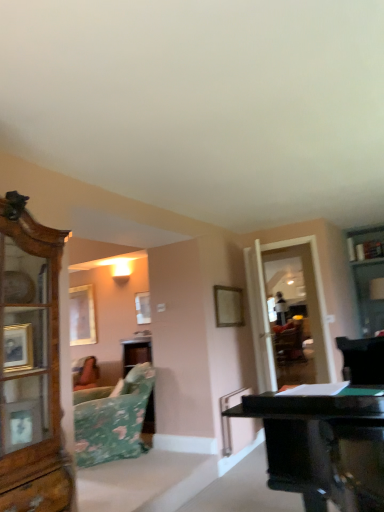
Question: From a real-world perspective, is wooden picture frame at upper left, the 2th picture frame positioned from the front, positioned over floral fabric couch at lower left based on gravity?

Choices:
 (A) yes
 (B) no

Answer: (A)

Question: Is wooden picture frame at upper left, arranged as the 2th picture frame when viewed from the right, at the left side of floral fabric couch at lower left?

Choices:
 (A) no
 (B) yes

Answer: (B)

Question: Is wooden picture frame at upper left, the 2th picture frame positioned from the front, positioned far away from floral fabric couch at lower left?

Choices:
 (A) no
 (B) yes

Answer: (B)

Question: Is wooden picture frame at upper left, arranged as the 2th picture frame when viewed from the right, outside of floral fabric couch at lower left?

Choices:
 (A) no
 (B) yes

Answer: (B)

Question: Is wooden picture frame at upper left, the 1th picture frame when ordered from back to front, to the right of floral fabric couch at lower left from the viewer's perspective?

Choices:
 (A) no
 (B) yes

Answer: (A)

Question: Is transparent glass door at right inside the boundaries of wooden picture frame at center, marked as the 2th picture frame in a back-to-front arrangement, or outside?

Choices:
 (A) inside
 (B) outside

Answer: (B)

Question: From the image's perspective, is transparent glass door at right located above or below wooden picture frame at center, placed as the 2th picture frame when sorted from left to right?

Choices:
 (A) above
 (B) below

Answer: (B)

Question: Based on their sizes in the image, would you say transparent glass door at right is bigger or smaller than wooden picture frame at center, placed as the 2th picture frame when sorted from left to right?

Choices:
 (A) big
 (B) small

Answer: (A)

Question: From a real-world perspective, is transparent glass door at right positioned above or below wooden picture frame at center, the first picture frame positioned from the front?

Choices:
 (A) above
 (B) below

Answer: (B)

Question: Would you say wooden picture frame at upper left, which is the first picture frame from left to right, is to the left or to the right of wooden picture frame at center, placed as the 2th picture frame when sorted from left to right, in the picture?

Choices:
 (A) right
 (B) left

Answer: (B)

Question: From their relative heights in the image, would you say wooden picture frame at upper left, arranged as the 2th picture frame when viewed from the right, is taller or shorter than wooden picture frame at center, placed as the 2th picture frame when sorted from left to right?

Choices:
 (A) tall
 (B) short

Answer: (A)

Question: In the image, is wooden picture frame at upper left, arranged as the 2th picture frame when viewed from the right, positioned in front of or behind wooden picture frame at center, marked as the 2th picture frame in a back-to-front arrangement?

Choices:
 (A) front
 (B) behind

Answer: (B)

Question: Does point (72, 309) appear closer or farther from the camera than point (241, 296)?

Choices:
 (A) closer
 (B) farther

Answer: (B)

Question: Would you say floral fabric couch at lower left is to the left or to the right of wooden picture frame at center, marked as the 2th picture frame in a back-to-front arrangement, in the picture?

Choices:
 (A) left
 (B) right

Answer: (A)

Question: From a real-world perspective, is floral fabric couch at lower left physically located above or below wooden picture frame at center, placed as the 2th picture frame when sorted from left to right?

Choices:
 (A) above
 (B) below

Answer: (B)